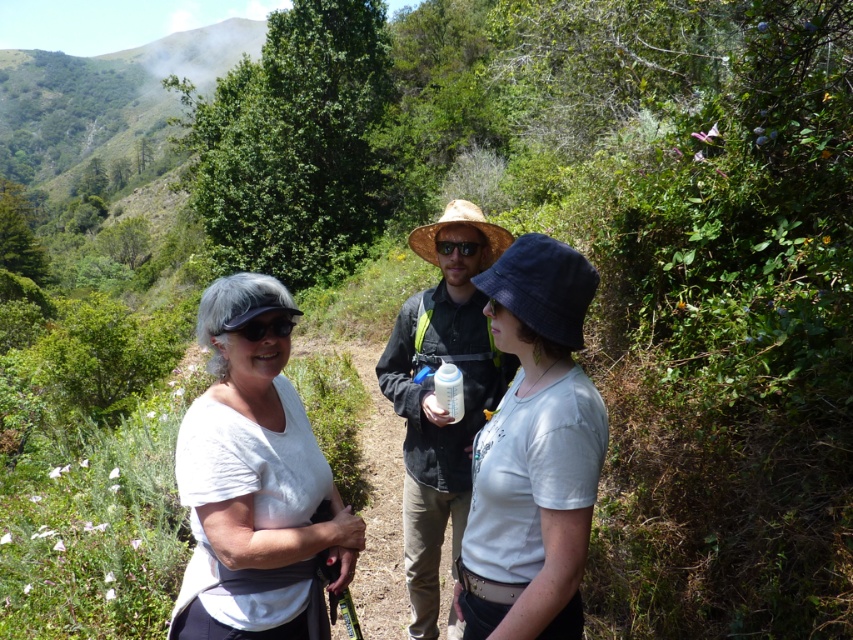
You are trying to decide whether to place a matte straw hat at center on a shelf that can only hold items narrower than the gold reflective sunglasses at center. Can the hat be placed there?

The matte straw hat at center might be wider than gold reflective sunglasses at center, so it may not fit on the shelf if the shelf can only hold items narrower than the sunglasses.

You are a photographer trying to capture a closeup of the gold reflective sunglasses at center without including the white matte shirt at center in the frame. Given their sizes, is this possible?

The white matte shirt at center is wider than the gold reflective sunglasses at center, so it might be challenging to frame the sunglasses without including the shirt if they are positioned closely together.

You are a photographer taking a portrait of the person at the center. You notice the white matte shirt at center and the gold reflective sunglasses at center. Which item should you adjust to ensure the subject looks more balanced in the photo?

The white matte shirt at center is taller than the gold reflective sunglasses at center. To balance the composition, you should lower the white matte shirt at center or raise the gold reflective sunglasses at center so they are at the same height.